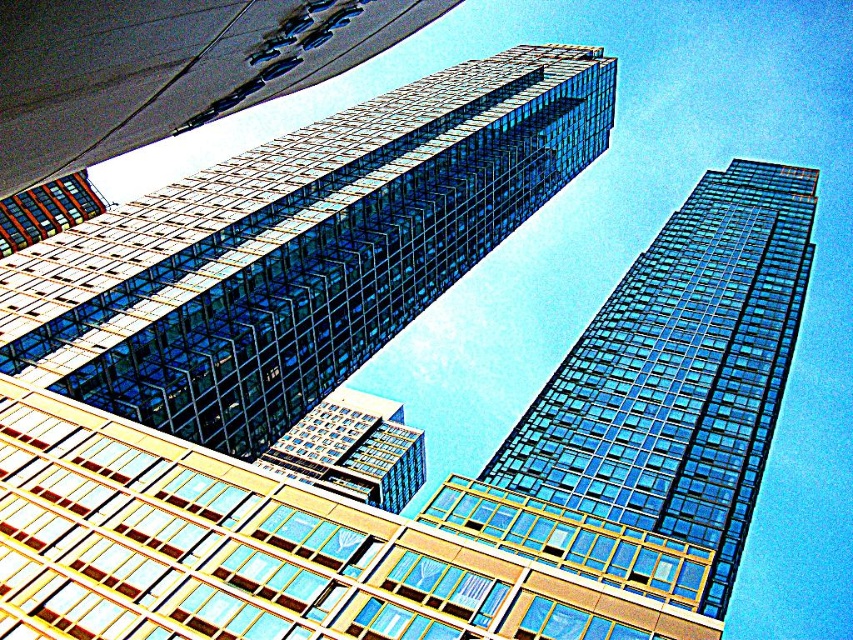
You are standing at the base of the transparent glass building at upper center. You want to throw a ball to a friend who is standing 150 feet away from you. Can you reach them by throwing the ball from your current position?

The transparent glass building at upper center is 151.96 feet away from the viewer. Since your friend is only 150 feet away, you are actually 1.96 feet farther than that distance. Therefore, you cannot reach them by throwing the ball from your current position.

You are standing at the base of the beige facade building in the foreground of the image. You see a point marked at coordinates (660, 403). What does this point indicate?

The point at (660, 403) marks the location of the transparent glass skyscraper at upper right.

From the picture: You are an architect analyzing the skyscrapers in the image. Which of the two buildings, the transparent glass building at upper center or the clear glass building at center, has a greater height?

The transparent glass building at upper center is much taller than the clear glass building at center, so it has a greater height.